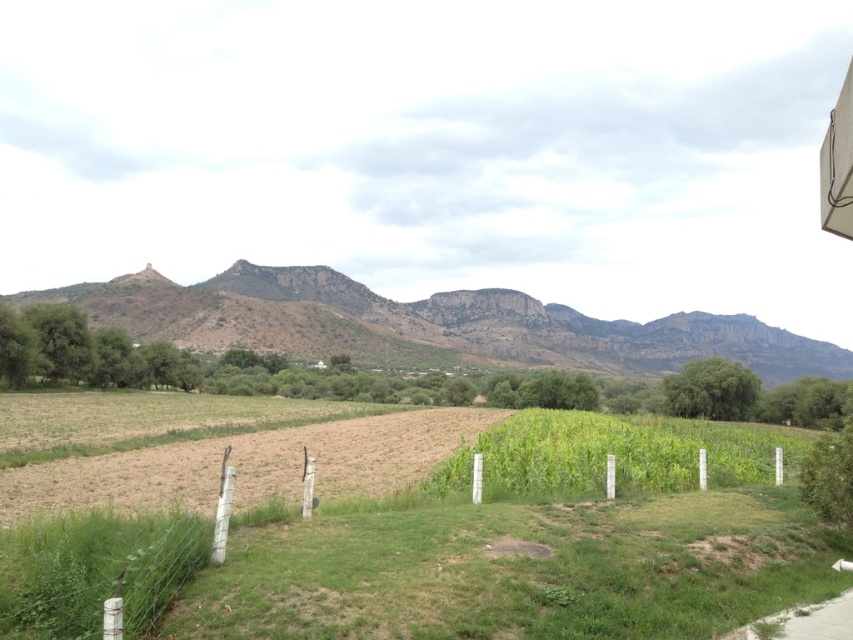
You are standing at the center of the image and want to walk towards the green grassy vineyard at center. Which direction should you head?

The green grassy vineyard at center is located at point [492,552], so you should head towards the coordinates provided to reach it.

You are standing in the rural landscape and want to determine which point is closer to you. The points are point (460,332) and point (648,492). Which point is closer to your current position?

Point (460,332) is further to the viewer than point (648,492), so the closer point to your current position is point (648,492).